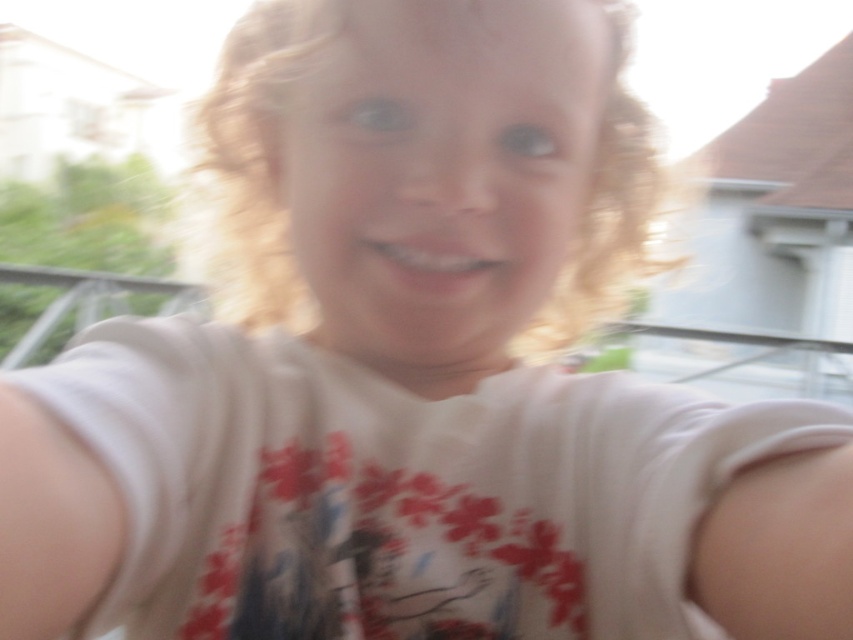
Based on the image, which object is wider when viewed from the front? The blonde curly hair at center or the smooth matte teeth at center?

The blonde curly hair at center is wider than the smooth matte teeth at center according to the description.